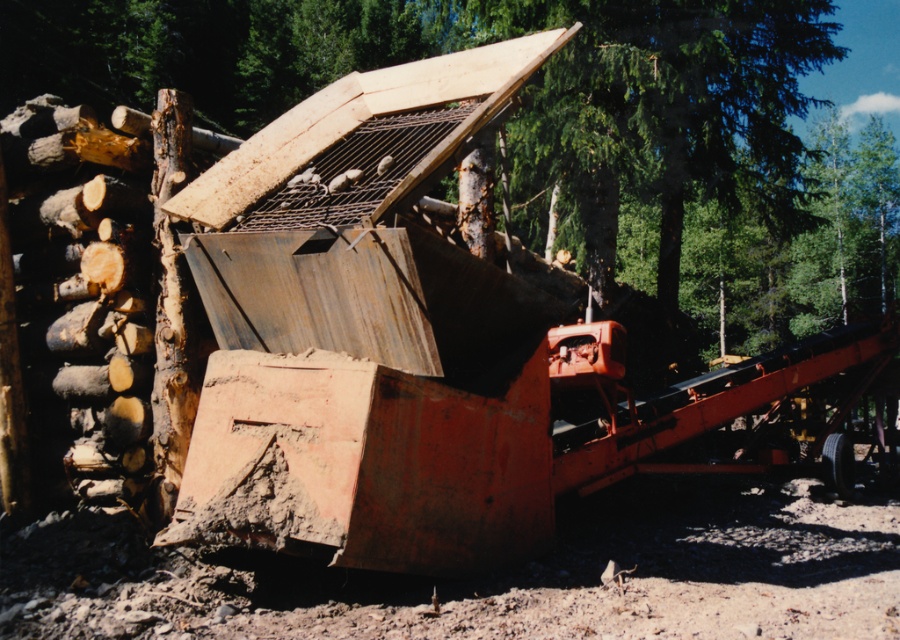
Question: Considering the relative positions of rusty metal trailer truck at center and smooth wooden log at center in the image provided, where is rusty metal trailer truck at center located with respect to smooth wooden log at center?

Choices:
 (A) above
 (B) below

Answer: (B)

Question: Is the position of rusty metal trailer truck at center more distant than that of smooth wooden log at center?

Choices:
 (A) no
 (B) yes

Answer: (B)

Question: Which point is closer to the camera?

Choices:
 (A) (537, 128)
 (B) (295, 364)

Answer: (B)

Question: Is rusty metal trailer truck at center above smooth wooden log at center?

Choices:
 (A) yes
 (B) no

Answer: (B)

Question: Which of the following is the farthest from the observer?

Choices:
 (A) smooth wooden log at center
 (B) rusty metal trailer truck at center

Answer: (B)

Question: Which point is closer to the camera taking this photo?

Choices:
 (A) (767, 93)
 (B) (397, 545)

Answer: (B)